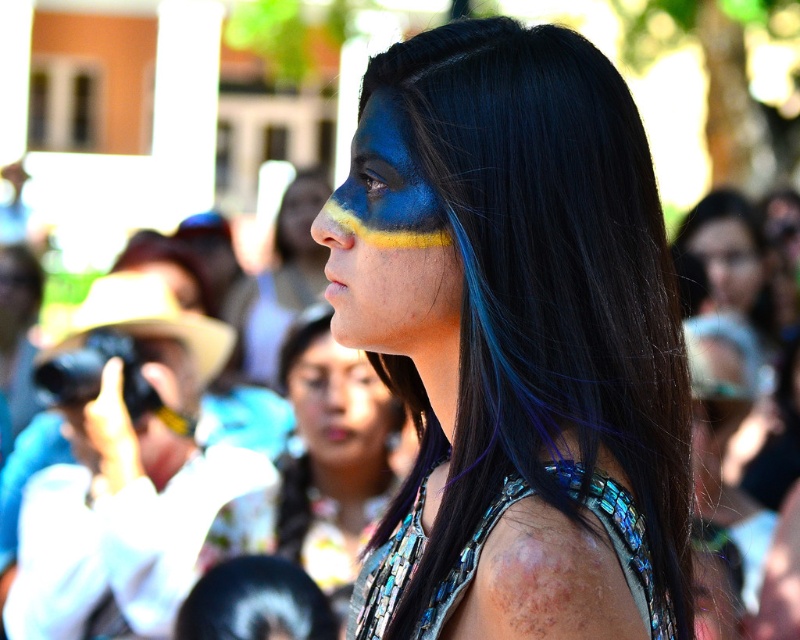
Question: Can you confirm if matte blue face at center is smaller than blue matte paint at nose?

Choices:
 (A) yes
 (B) no

Answer: (B)

Question: Which is nearer to the blue matte paint at center?

Choices:
 (A) blue matte paint at nose
 (B) blue matte face paint at center

Answer: (B)

Question: Based on their relative distances, which object is nearer to the blue metallic hair at center?

Choices:
 (A) blue matte face paint at center
 (B) blue matte paint at nose
 (C) matte blue face at center

Answer: (C)

Question: Which point is closer to the camera?

Choices:
 (A) (696, 241)
 (B) (425, 333)

Answer: (B)

Question: Is blue metallic hair at center above blue matte face paint at center?

Choices:
 (A) no
 (B) yes

Answer: (B)

Question: Considering the relative positions of blue metallic hair at center and blue matte paint at nose in the image provided, where is blue metallic hair at center located with respect to blue matte paint at nose?

Choices:
 (A) above
 (B) below

Answer: (B)